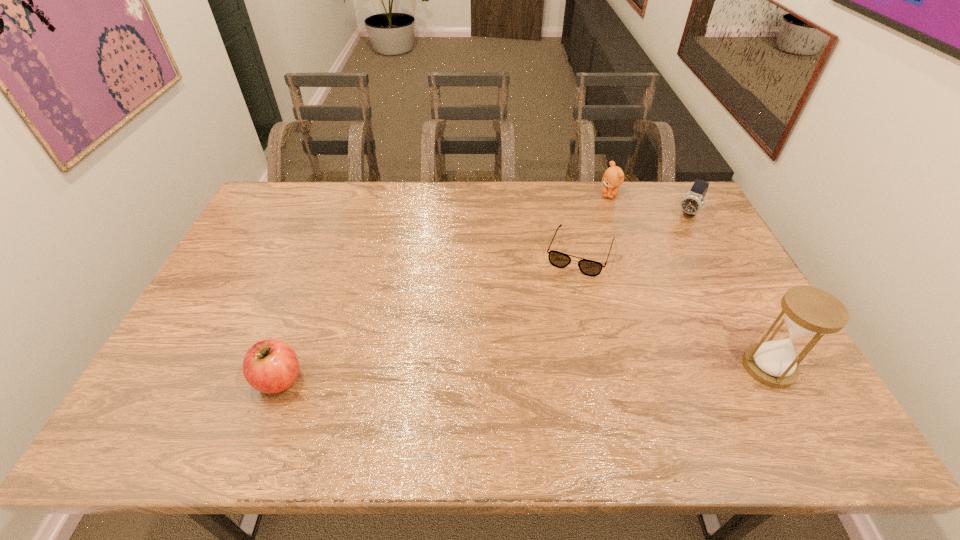
In order to click on free space between the tallest object and the leftmost object in this screenshot , I will do `click(524, 373)`.

Choose which object is the second nearest neighbor to the farthest object. Please provide its 2D coordinates. Your answer should be formatted as a tuple, i.e. [(x, y)], where the tuple contains the x and y coordinates of a point satisfying the conditions above.

[(691, 203)]

Where is `object that is the nearest to the hourglass`? The image size is (960, 540). object that is the nearest to the hourglass is located at coordinates (558, 259).

Locate an element on the screen. This screenshot has height=540, width=960. vacant point that satisfies the following two spatial constraints: 1. on the back side of the fourth nearest object; 2. on the left side of the shortest object is located at coordinates (571, 214).